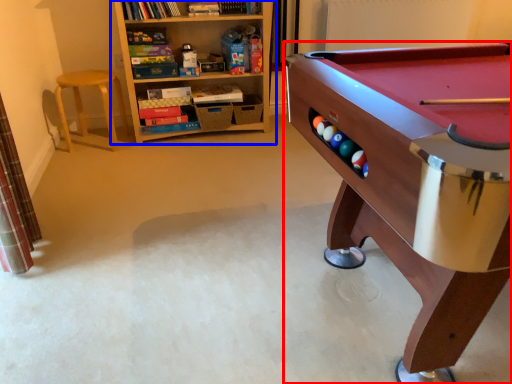
Question: Which object appears farthest to the camera in this image, table (highlighted by a red box) or bookcase (highlighted by a blue box)?

Choices:
 (A) table
 (B) bookcase

Answer: (B)